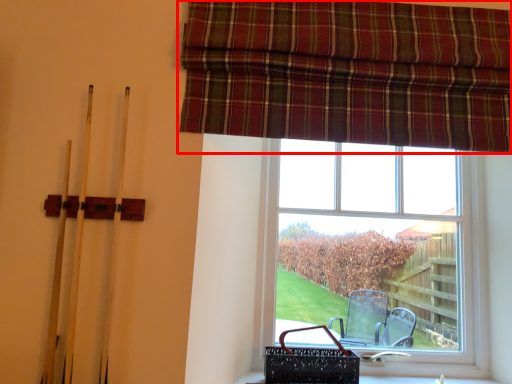
Question: In this image, where is curtain (annotated by the red box) located relative to window?

Choices:
 (A) right
 (B) left

Answer: (B)